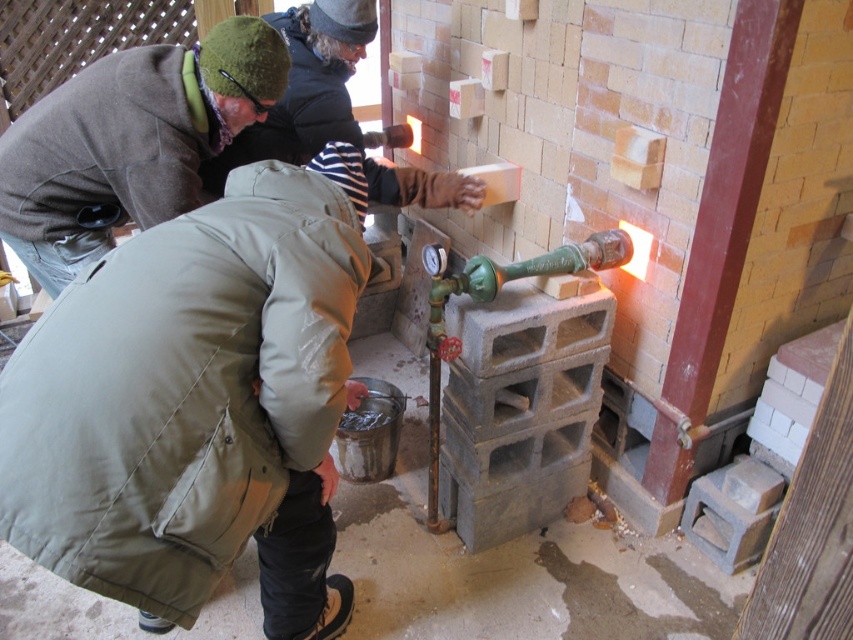
Question: Can you confirm if green matte jacket at lower left is positioned below green woolen hat at upper left?

Choices:
 (A) no
 (B) yes

Answer: (B)

Question: Considering the relative positions of green matte jacket at lower left and green woolen hat at upper left in the image provided, where is green matte jacket at lower left located with respect to green woolen hat at upper left?

Choices:
 (A) left
 (B) right

Answer: (B)

Question: Which of the following is the closest to the observer?

Choices:
 (A) (206, 118)
 (B) (332, 376)

Answer: (B)

Question: Does green matte jacket at lower left appear under green woolen hat at upper left?

Choices:
 (A) yes
 (B) no

Answer: (A)